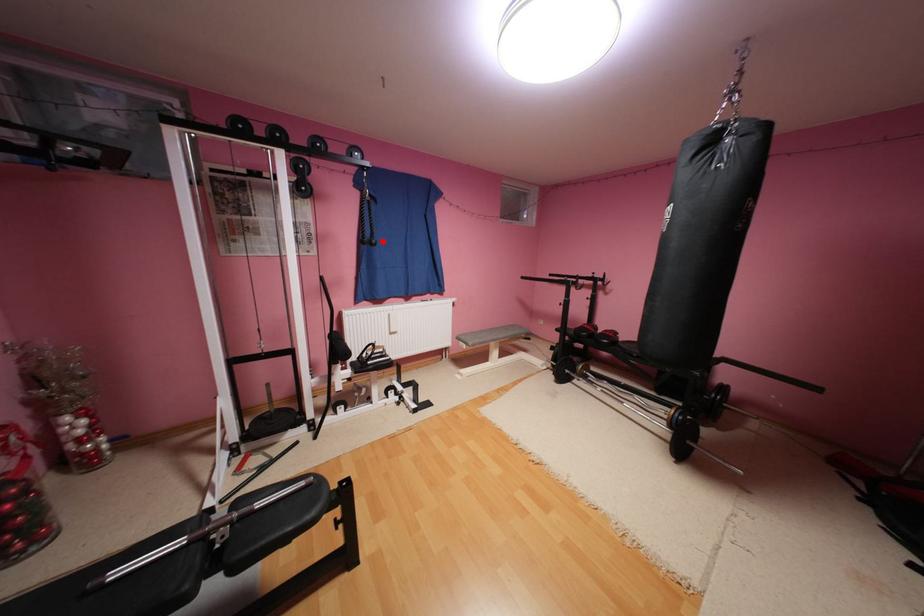
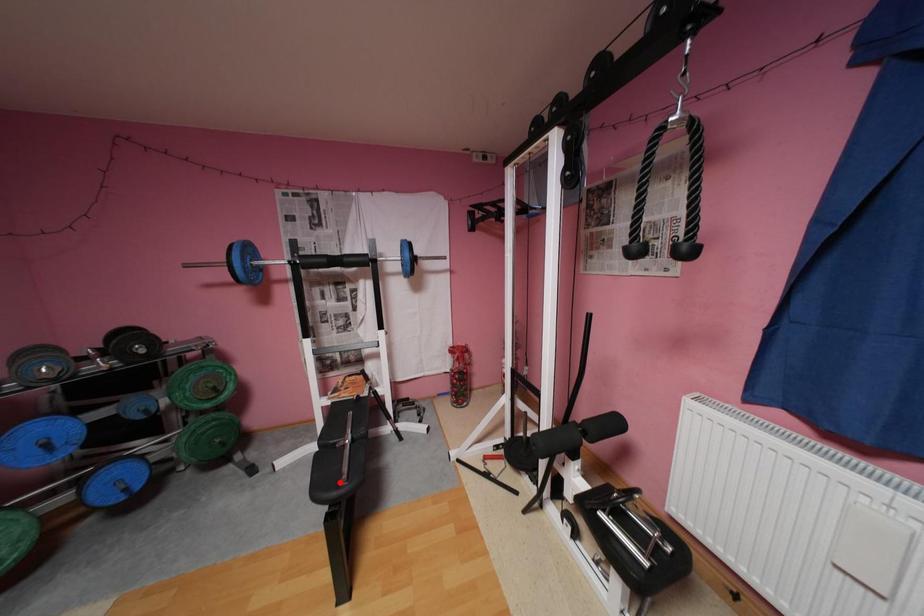
I am providing you with two images of the same scene from different viewpoints. A red point is marked on the first image and another point is marked on the second image. Is the marked point in image1 the same physical position as the marked point in image2?

No